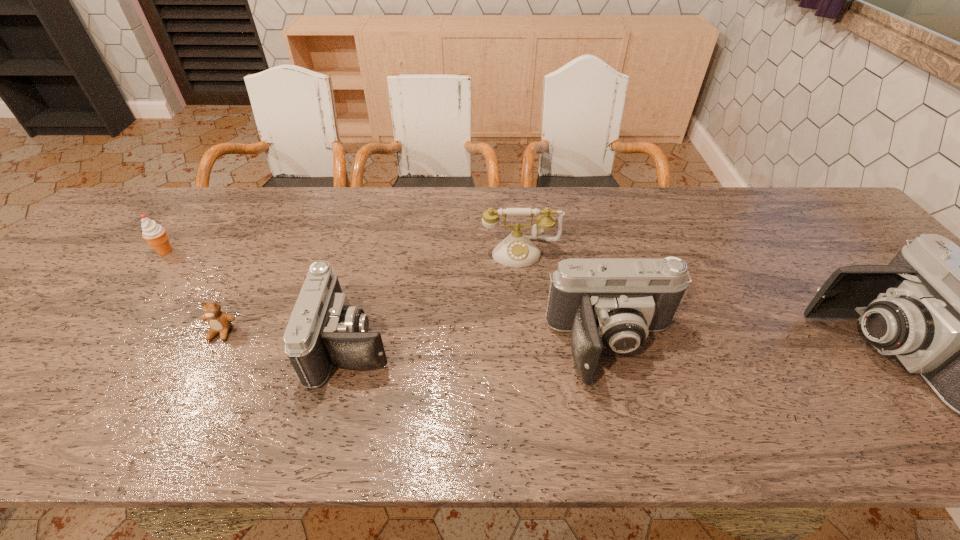
What are the coordinates of `free space located on the dial of the telephone` in the screenshot? It's located at 528,323.

In order to click on blank space located 0.080m on the front-facing side of the teddy bear in this screenshot , I will do `click(201, 373)`.

Where is `free spot at the far edge of the desktop`? Image resolution: width=960 pixels, height=540 pixels. free spot at the far edge of the desktop is located at coordinates (421, 217).

Find the location of a particular element. vacant space at the near edge of the desktop is located at coordinates (736, 375).

You are a GUI agent. You are given a task and a screenshot of the screen. Output one action in this format:
    pyautogui.click(x=<x>, y=<y>)
    Task: Click on the vacant space at the left edge of the desktop
    Image resolution: width=960 pixels, height=540 pixels.
    Given the screenshot: What is the action you would take?
    pyautogui.click(x=69, y=301)

The width and height of the screenshot is (960, 540). What are the coordinates of `blank space at the far right corner of the desktop` in the screenshot? It's located at (794, 188).

Identify the location of free spot between the leftmost object and the leftmost camera. (259, 298).

I want to click on empty space between the telephone and the shortest camera, so click(437, 298).

Locate an element on the screen. vacant area that lies between the telephone and the leftmost object is located at coordinates (343, 252).

Point out which object is positioned as the second nearest to the fourth object from right to left. Please provide its 2D coordinates. Your answer should be formatted as a tuple, i.e. [(x, y)], where the tuple contains the x and y coordinates of a point satisfying the conditions above.

[(516, 250)]